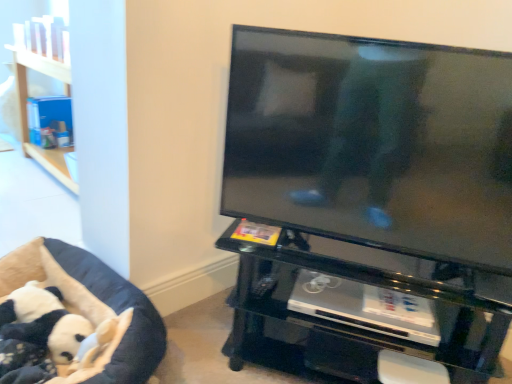
Question: From the image's perspective, is black glass tv stand at center, acting as the 2th furniture starting from the left, below black plush dog bed at lower left, placed as the first furniture when sorted from left to right?

Choices:
 (A) no
 (B) yes

Answer: (A)

Question: Does black glass tv stand at center, acting as the first furniture starting from the right, have a lesser height compared to black plush dog bed at lower left, placed as the first furniture when sorted from left to right?

Choices:
 (A) no
 (B) yes

Answer: (A)

Question: Is black plush dog bed at lower left, placed as the first furniture when sorted from left to right, at the back of black glass tv stand at center, acting as the first furniture starting from the right?

Choices:
 (A) no
 (B) yes

Answer: (A)

Question: Considering the relative sizes of black glass tv stand at center, acting as the first furniture starting from the right, and black plush dog bed at lower left, the second furniture in the right-to-left sequence, in the image provided, is black glass tv stand at center, acting as the first furniture starting from the right, wider than black plush dog bed at lower left, the second furniture in the right-to-left sequence,?

Choices:
 (A) yes
 (B) no

Answer: (A)

Question: Does black glass tv stand at center, acting as the first furniture starting from the right, have a greater height compared to black plush dog bed at lower left, placed as the first furniture when sorted from left to right?

Choices:
 (A) no
 (B) yes

Answer: (B)

Question: Can you confirm if black glass tv stand at center, acting as the 2th furniture starting from the left, is bigger than black plush dog bed at lower left, the second furniture in the right-to-left sequence?

Choices:
 (A) no
 (B) yes

Answer: (B)

Question: Can you confirm if black plush dog bed at lower left, placed as the first furniture when sorted from left to right, is positioned to the left of black plush panda at lower left?

Choices:
 (A) no
 (B) yes

Answer: (A)

Question: From a real-world perspective, is black plush dog bed at lower left, the second furniture in the right-to-left sequence, below black plush panda at lower left?

Choices:
 (A) no
 (B) yes

Answer: (B)

Question: From a real-world perspective, is black plush dog bed at lower left, placed as the first furniture when sorted from left to right, physically above black plush panda at lower left?

Choices:
 (A) yes
 (B) no

Answer: (B)

Question: Is black plush dog bed at lower left, the second furniture in the right-to-left sequence, closer to the viewer compared to black plush panda at lower left?

Choices:
 (A) yes
 (B) no

Answer: (A)

Question: Is black plush dog bed at lower left, placed as the first furniture when sorted from left to right, thinner than black plush panda at lower left?

Choices:
 (A) yes
 (B) no

Answer: (B)

Question: Considering the relative sizes of black plush dog bed at lower left, the second furniture in the right-to-left sequence, and black plush panda at lower left in the image provided, is black plush dog bed at lower left, the second furniture in the right-to-left sequence, smaller than black plush panda at lower left?

Choices:
 (A) yes
 (B) no

Answer: (B)

Question: Would you consider black plush panda at lower left to be distant from black glossy tv at upper right?

Choices:
 (A) yes
 (B) no

Answer: (B)